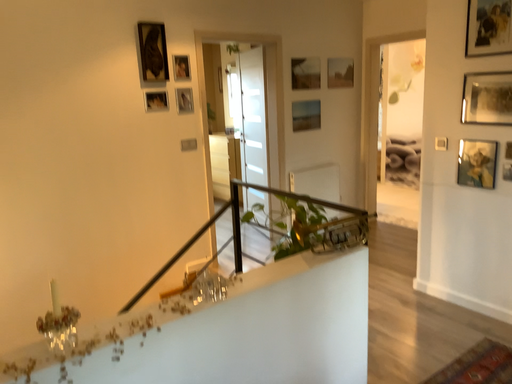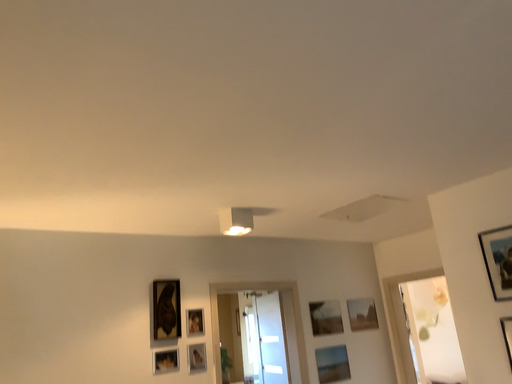
Question: Which way did the camera rotate in the video?

Choices:
 (A) rotated upward
 (B) rotated downward

Answer: (A)